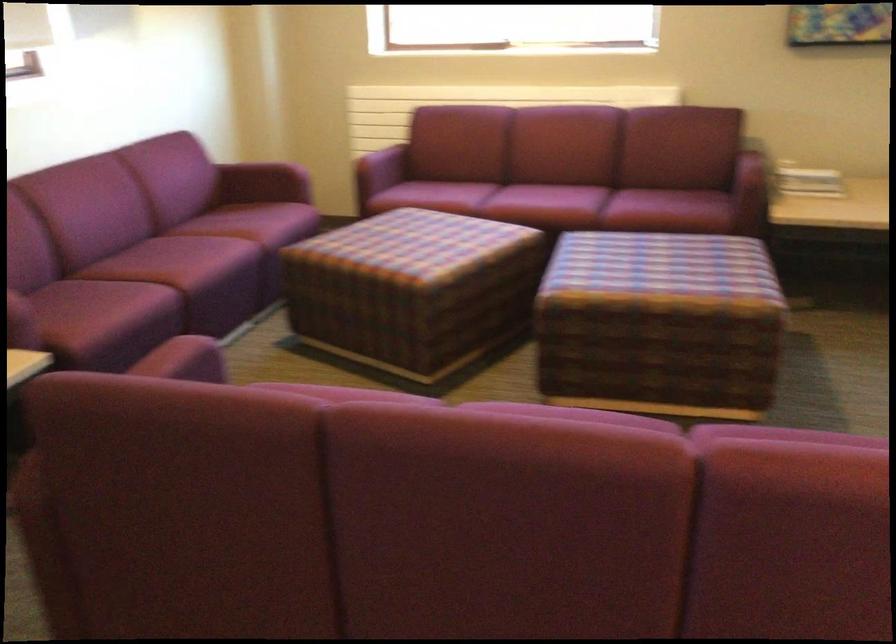
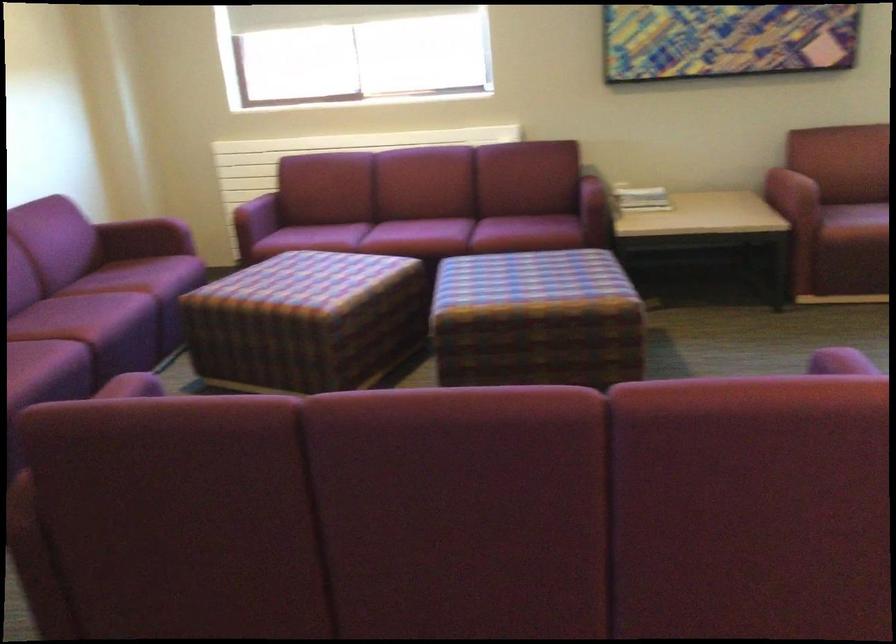
In the second image, find the point that corresponds to pixel 657 317 in the first image.

(536, 319)